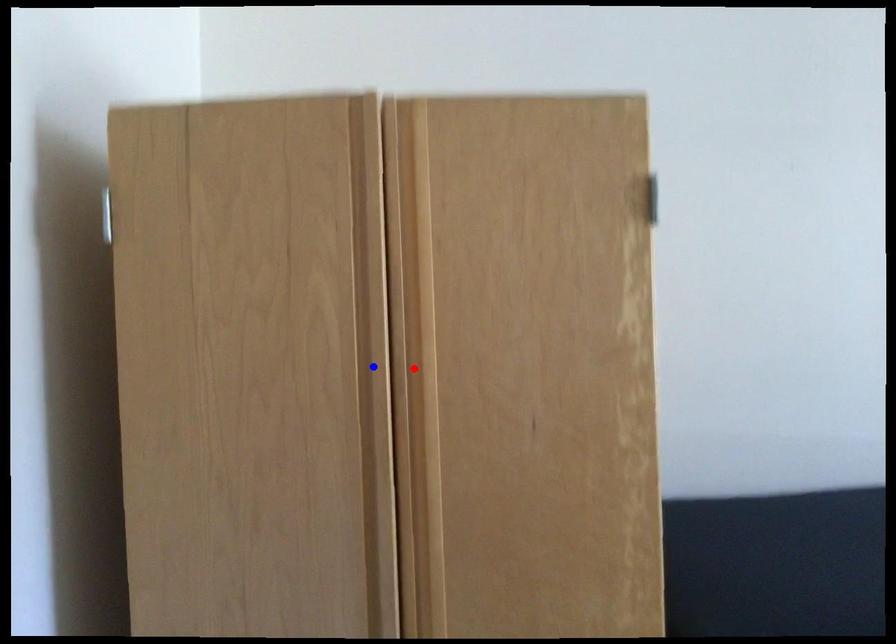
Question: Two points are marked on the image. Which point is closer to the camera?

Choices:
 (A) Blue point is closer.
 (B) Red point is closer.

Answer: (A)